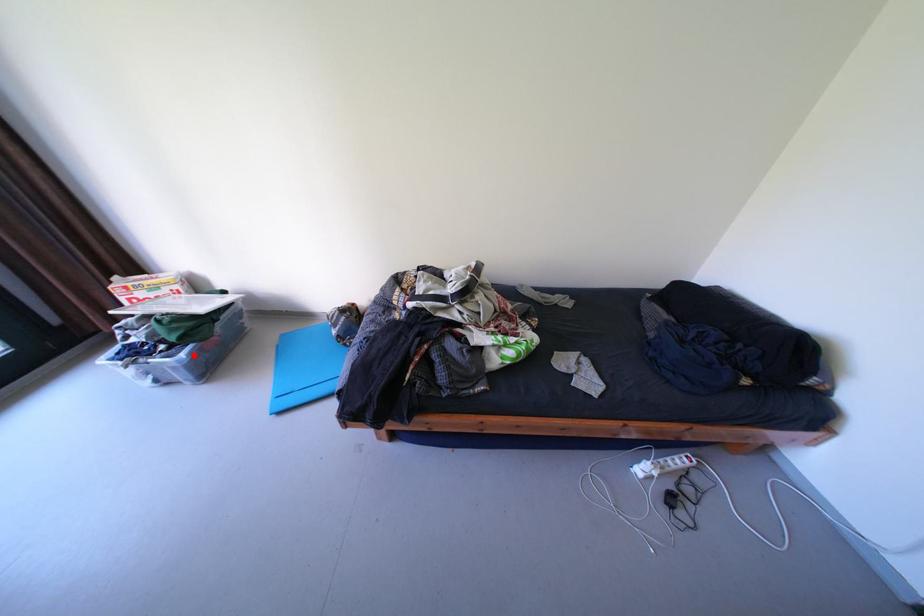
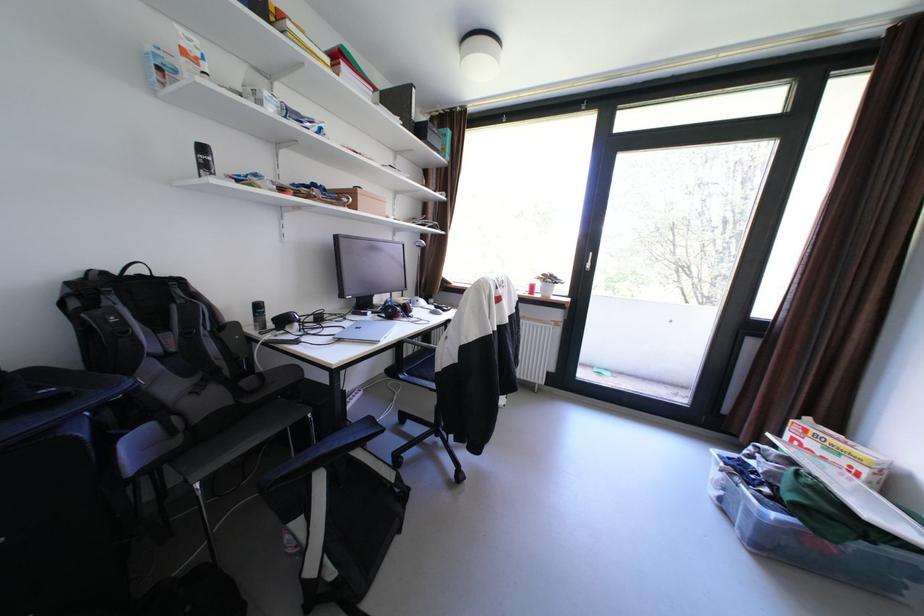
Question: I am providing you with two images of the same scene from different viewpoints. A red point is marked on the first image. Can you still see the location of the red point in image 2?

Choices:
 (A) Yes
 (B) No

Answer: (A)